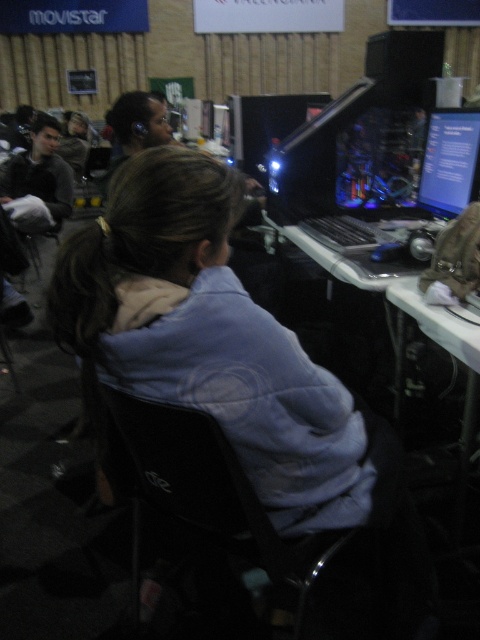
Which is below, light blue fleece at center or matte black monitor at upper right?

light blue fleece at center is lower down.

Between light blue fleece at center and matte black monitor at upper right, which one has more height?

light blue fleece at center

Is point (132, 304) positioned before point (469, 125)?

That is True.

Find the location of `light blue fleece at center`. light blue fleece at center is located at coordinates (210, 339).

Which of these two, light blue fleece at center or black fabric chair at center, stands taller?

With more height is light blue fleece at center.

Does point (195, 161) come farther from viewer compared to point (232, 461)?

Yes.

Locate an element on the screen. Image resolution: width=480 pixels, height=640 pixels. light blue fleece at center is located at coordinates (210, 339).

Find the location of a particular element. This screenshot has height=640, width=480. light blue fleece at center is located at coordinates (x=210, y=339).

Does black fabric chair at center have a greater height compared to matte black monitor at upper right?

Yes, black fabric chair at center is taller than matte black monitor at upper right.

This screenshot has width=480, height=640. Describe the element at coordinates (205, 492) in the screenshot. I see `black fabric chair at center` at that location.

Locate an element on the screen. black fabric chair at center is located at coordinates (205, 492).